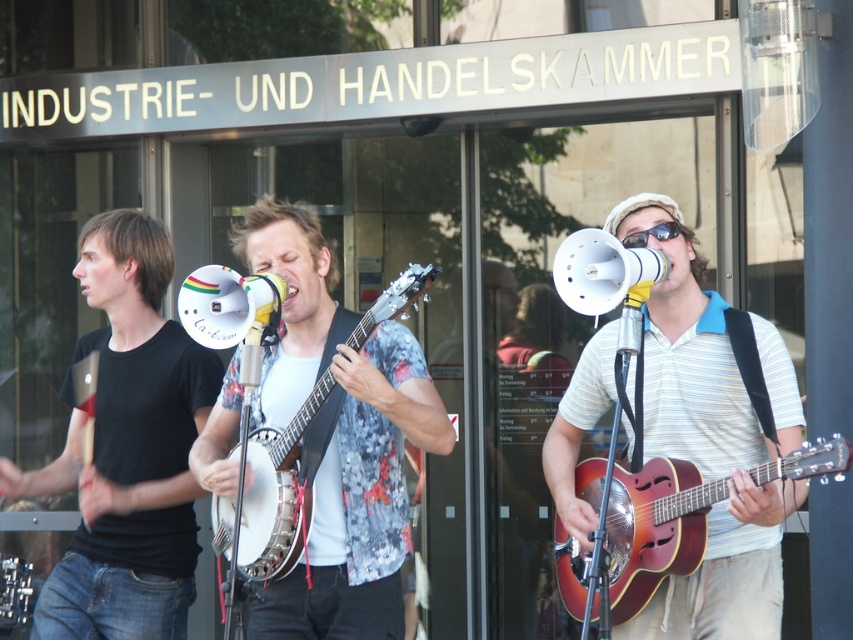
Question: Can you confirm if black matte t-shirt at left is wider than varnished wood guitar at center?

Choices:
 (A) no
 (B) yes

Answer: (B)

Question: Which point is farther from the camera taking this photo?

Choices:
 (A) (64, 490)
 (B) (554, 474)
 (C) (672, 534)

Answer: (A)

Question: Is black matte t-shirt at left wider than white wood banjo at center?

Choices:
 (A) no
 (B) yes

Answer: (B)

Question: Can you confirm if striped cotton shirt at center is positioned above black matte t-shirt at left?

Choices:
 (A) yes
 (B) no

Answer: (B)

Question: Which point is farther from the camera taking this photo?

Choices:
 (A) (595, 484)
 (B) (248, 550)

Answer: (A)

Question: Estimate the real-world distances between objects in this image. Which object is farther from the black matte t-shirt at left?

Choices:
 (A) white wood banjo at center
 (B) striped cotton shirt at center
 (C) varnished wood guitar at center

Answer: (B)